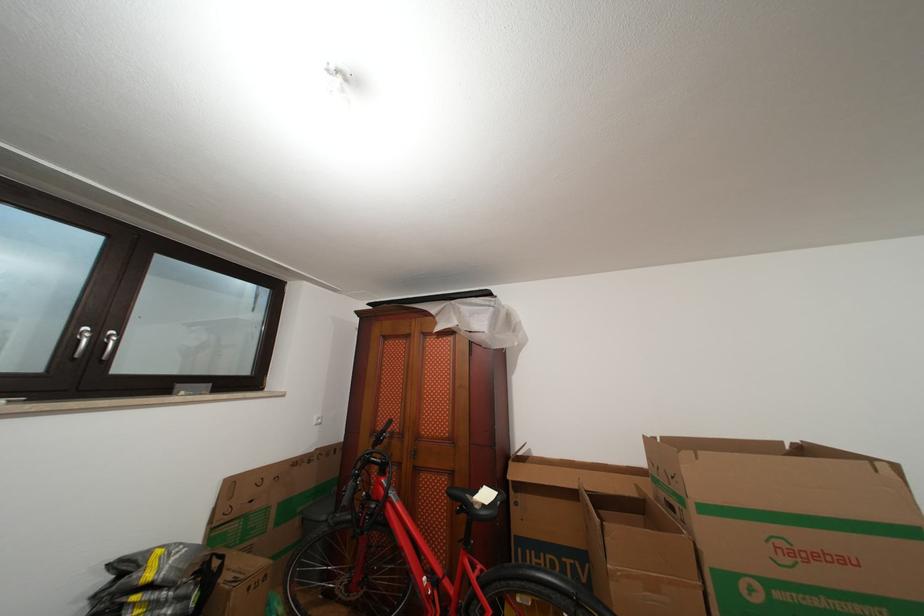
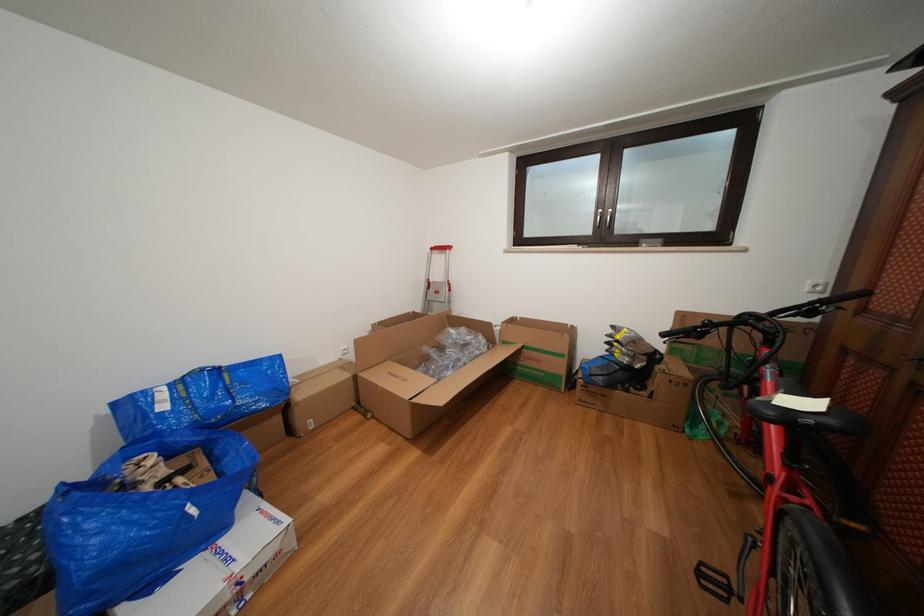
Where in the second image is the point corresponding to (83,328) from the first image?

(605, 214)